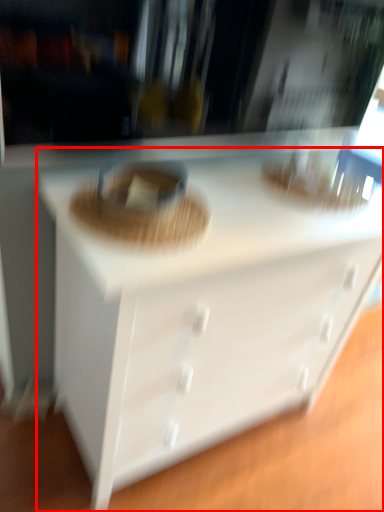
Question: From the image's perspective, considering the relative positions of chest of drawers (annotated by the red box) and food in the image provided, where is chest of drawers (annotated by the red box) located with respect to the staircase?

Choices:
 (A) above
 (B) below

Answer: (B)